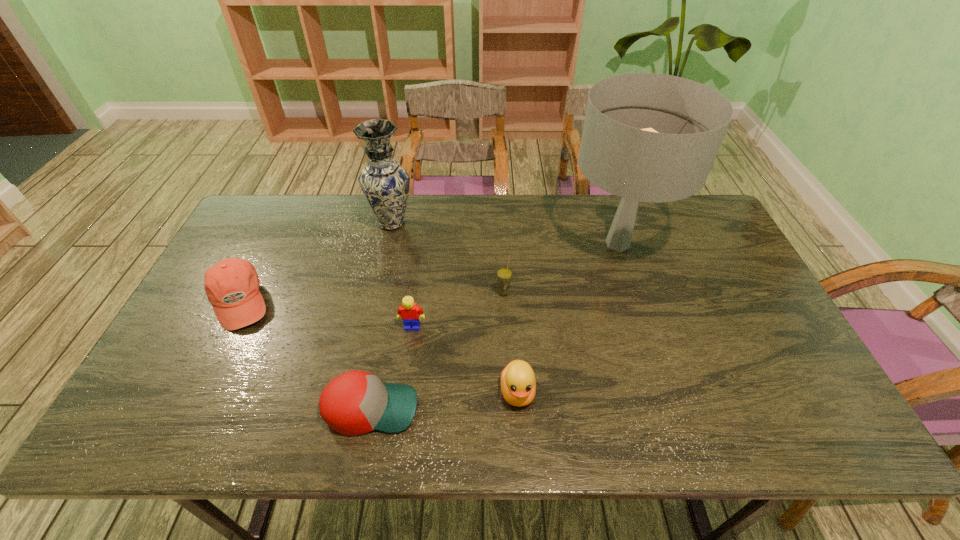
I want to click on vacant space located on the front-facing side of the rightmost object, so click(x=636, y=303).

Locate an element on the screen. vacant region located 0.320m on the front of the vase is located at coordinates (372, 316).

Locate an element on the screen. free spot located 0.280m on the left of the straw for drinking is located at coordinates (398, 293).

Image resolution: width=960 pixels, height=540 pixels. In order to click on free space located 0.080m on the front-facing side of the Lego in this screenshot , I will do `click(408, 356)`.

At what (x,y) coordinates should I click in order to perform the action: click on free space located on the back of the leftmost object. Please return your answer as a coordinate pair (x, y). This screenshot has height=540, width=960. Looking at the image, I should click on pyautogui.click(x=286, y=207).

The width and height of the screenshot is (960, 540). In order to click on vacant point located at the brim of the nearer baseball cap in this screenshot , I will do `click(518, 408)`.

Where is `lampshade present at the far edge`? lampshade present at the far edge is located at coordinates click(x=648, y=137).

Find the location of `vase that is at the far edge`. vase that is at the far edge is located at coordinates (385, 184).

At what (x,y) coordinates should I click in order to perform the action: click on duckling located at the near edge. Please return your answer as a coordinate pair (x, y). Image resolution: width=960 pixels, height=540 pixels. Looking at the image, I should click on (518, 384).

Image resolution: width=960 pixels, height=540 pixels. What are the coordinates of `baseball cap at the near edge` in the screenshot? It's located at (356, 402).